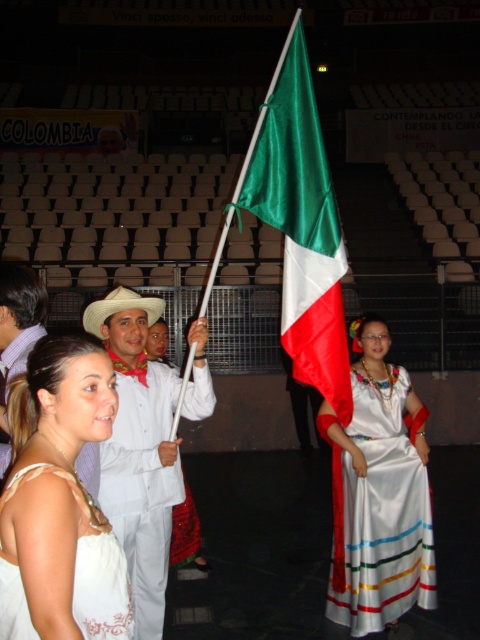
You are attending a cultural event in an indoor arena and notice two white garments in the foreground. The white satin dress at lower left and the matte white shirt at center. Which garment is positioned closer to the front of the stage?

The white satin dress at lower left is located below the matte white shirt at center, meaning it is closer to the front of the stage.

You are standing in the indoor stadium and want to take a photo of both the point at coordinates point (40, 413) and point (1, 332). Which point should you focus on first to ensure both are in clear view?

You should focus on point (40, 413) first because it is closer to the camera than point (1, 332), ensuring both points are in focus when using a shallow depth of field.

In the scene shown: You are standing at the center of the indoor stadium and see the white satin dress at lower left. Can you estimate its position relative to your current location?

The white satin dress at lower left is located at point 0.786 on the x axis and 0.125 on the y axis relative to your position at the center of the indoor stadium.